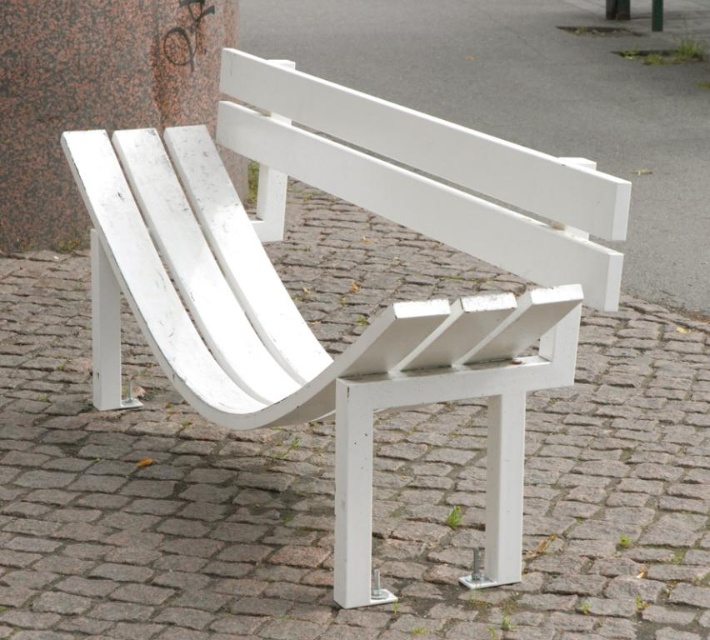
Question: Is white painted wood bench at center above smooth granite pillar at upper center?

Choices:
 (A) yes
 (B) no

Answer: (B)

Question: Among these objects, which one is nearest to the camera?

Choices:
 (A) smooth granite pillar at upper center
 (B) white painted wood bench at center

Answer: (B)

Question: Which point is closer to the camera taking this photo?

Choices:
 (A) (621, 13)
 (B) (180, 392)

Answer: (B)

Question: Is white painted wood bench at center positioned at the back of smooth granite pillar at upper center?

Choices:
 (A) yes
 (B) no

Answer: (B)

Question: Where is white painted wood bench at center located in relation to smooth granite pillar at upper center in the image?

Choices:
 (A) above
 (B) below

Answer: (B)

Question: Which point is farther to the camera?

Choices:
 (A) white painted wood bench at center
 (B) smooth granite pillar at upper center

Answer: (B)